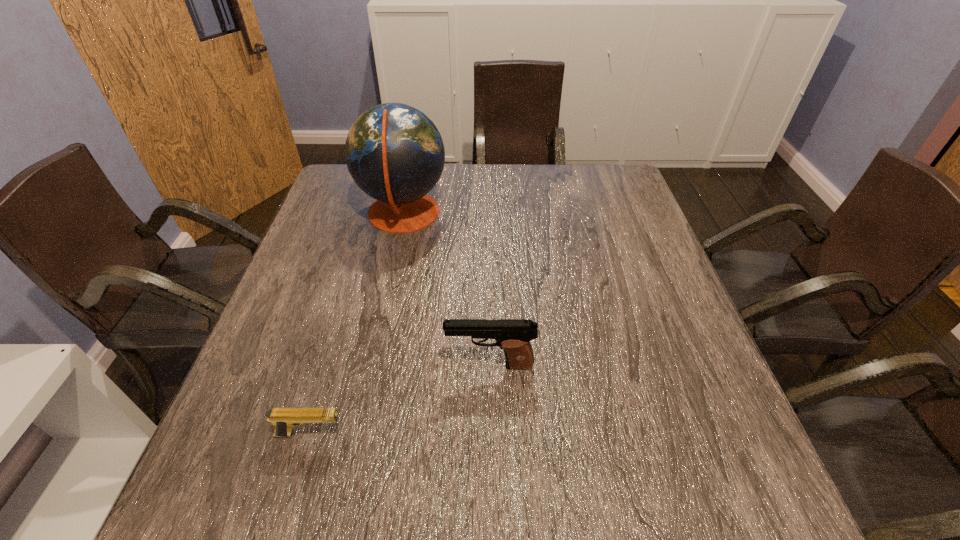
Find the location of `the farthest object`. the farthest object is located at coordinates coord(395,154).

Find the location of a particular element. the tallest object is located at coordinates (395, 154).

Where is `the taller pistol`? Image resolution: width=960 pixels, height=540 pixels. the taller pistol is located at coordinates (513, 336).

The image size is (960, 540). In order to click on the second nearest object in this screenshot , I will do `click(513, 336)`.

Locate an element on the screen. Image resolution: width=960 pixels, height=540 pixels. the nearest object is located at coordinates (284, 419).

Find the location of a particular element. This screenshot has width=960, height=540. the left pistol is located at coordinates [284, 419].

This screenshot has width=960, height=540. Find the location of `vacant region located 0.050m with the Americas facing the viewer on the globe`. vacant region located 0.050m with the Americas facing the viewer on the globe is located at coordinates (466, 214).

Locate an element on the screen. The width and height of the screenshot is (960, 540). free space located 0.220m at the barrel of the second tallest object is located at coordinates (337, 365).

Identify the location of free location located 0.110m at the barrel of the second tallest object. This screenshot has height=540, width=960. (392, 365).

This screenshot has width=960, height=540. Identify the location of free region located at the barrel of the second tallest object. (298, 365).